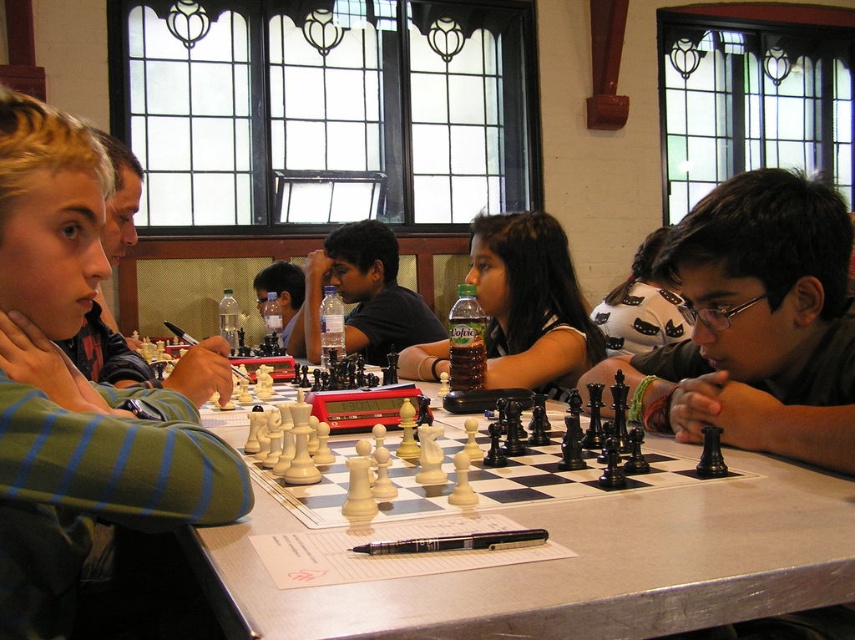
Question: Which point is farther from the camera taking this photo?

Choices:
 (A) coord(765,424)
 (B) coord(593,344)
 (C) coord(193,560)
 (D) coord(364,285)

Answer: (D)

Question: Is matte plastic bottle at center positioned in front of smooth black chess set at center?

Choices:
 (A) no
 (B) yes

Answer: (B)

Question: Among these points, which one is nearest to the camera?

Choices:
 (A) (531, 304)
 (B) (410, 321)
 (C) (656, 392)
 (D) (0, 492)

Answer: (D)

Question: Does green striped shirt at upper left appear on the right side of black glossy chess pieces at center?

Choices:
 (A) no
 (B) yes

Answer: (A)

Question: Does green striped shirt at upper left have a greater width compared to matte plastic bottle at center?

Choices:
 (A) no
 (B) yes

Answer: (A)

Question: Which of the following is the farthest from the observer?

Choices:
 (A) (435, 321)
 (B) (192, 536)
 (C) (139, 506)

Answer: (A)